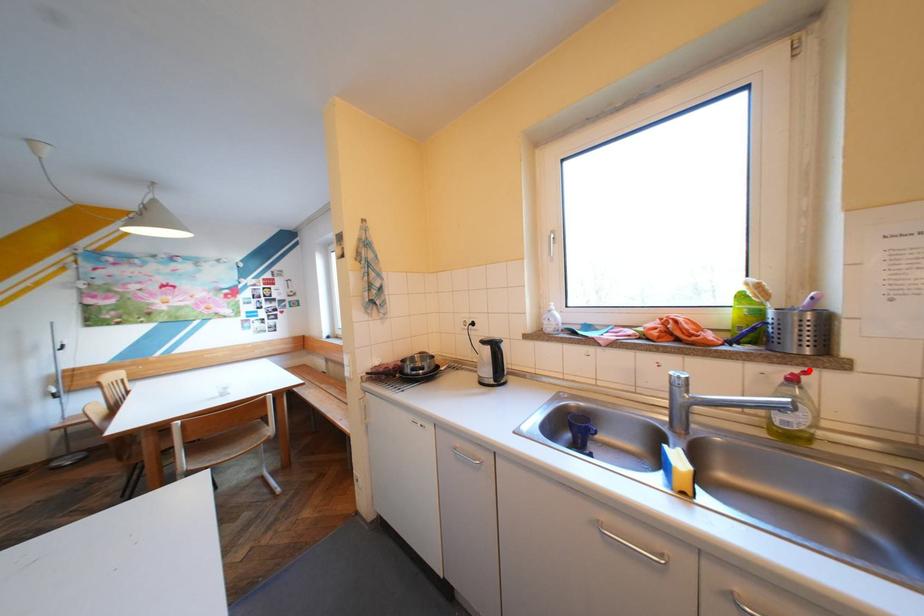
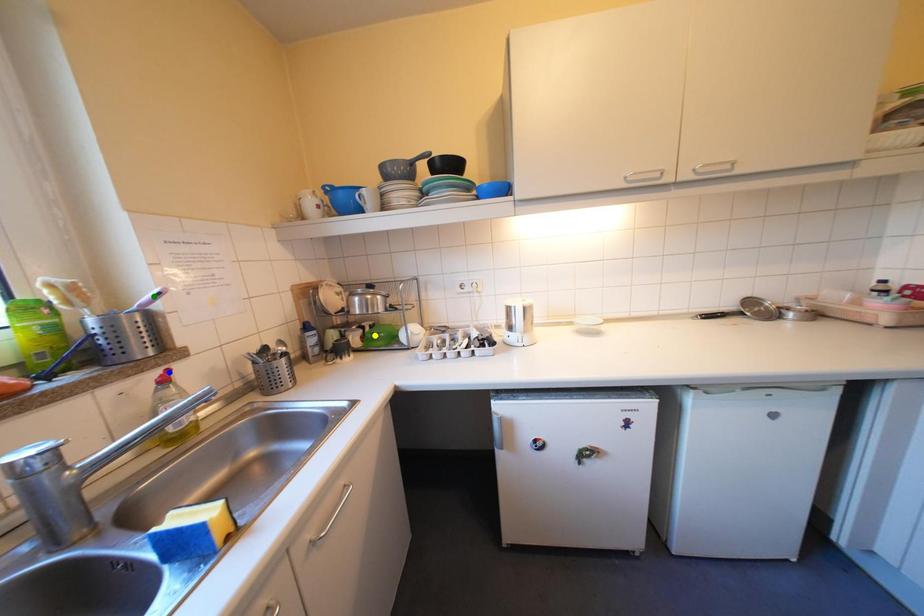
Question: I am providing you with two images of the same scene from different viewpoints. A red point is marked on the first image. You are given multiple points on the second image. Which point in image 2 represents the same 3d spot as the red point in image 1?

Choices:
 (A) yellow point
 (B) green point
 (C) blue point

Answer: (C)